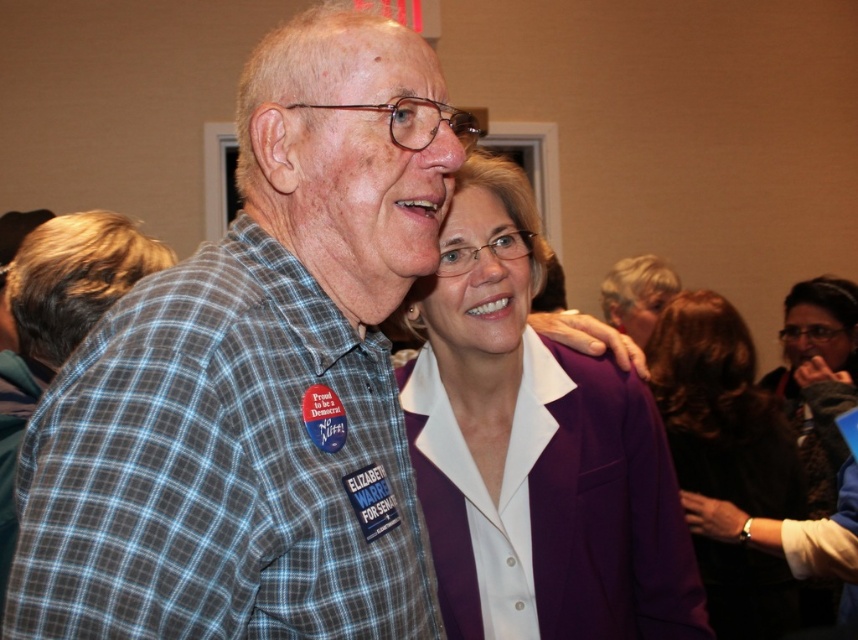
Question: Considering the real-world distances, which object is farthest from the purple fabric at center?

Choices:
 (A) purple fabric jacket at upper center
 (B) purple fabric jacket at center
 (C) plaid shirt at center
 (D) blue plaid shirt at center

Answer: (C)

Question: Does plaid shirt at center lie behind blue plaid shirt at center?

Choices:
 (A) no
 (B) yes

Answer: (A)

Question: Which object is positioned farthest from the blue plaid shirt at center?

Choices:
 (A) purple fabric jacket at center
 (B) plaid shirt at center

Answer: (B)

Question: Where is purple fabric jacket at center located in relation to blue plaid shirt at center in the image?

Choices:
 (A) left
 (B) right

Answer: (B)

Question: Can you confirm if plaid shirt at center is wider than purple fabric jacket at upper center?

Choices:
 (A) no
 (B) yes

Answer: (A)

Question: Which point appears closest to the camera in this image?

Choices:
 (A) (825, 324)
 (B) (505, 348)
 (C) (431, 604)
 (D) (740, 326)

Answer: (C)